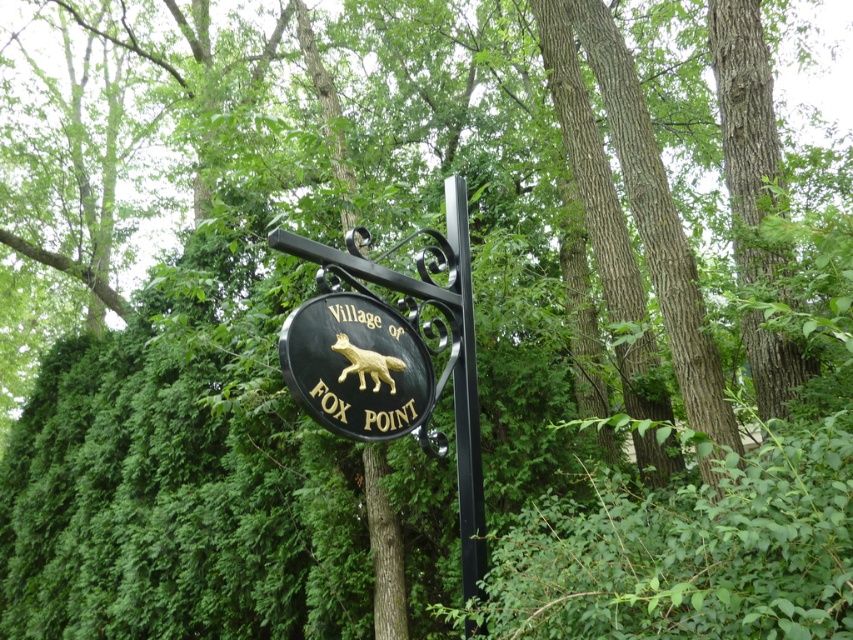
Question: Does gold metallic fox at center come in front of black polished wood sign at center?

Choices:
 (A) yes
 (B) no

Answer: (B)

Question: Can you confirm if black polished wood sign at center is positioned to the left of black metal pole at center?

Choices:
 (A) yes
 (B) no

Answer: (A)

Question: Which object is the closest to the gold metallic fox at center?

Choices:
 (A) black polished wood sign at center
 (B) black metal pole at center

Answer: (A)

Question: Which object is the farthest from the black metal pole at center?

Choices:
 (A) gold metallic fox at center
 (B) black polished wood sign at center

Answer: (B)

Question: Is black polished wood sign at center below black metal pole at center?

Choices:
 (A) no
 (B) yes

Answer: (A)

Question: Based on their relative distances, which object is nearer to the gold metallic fox at center?

Choices:
 (A) black polished wood sign at center
 (B) black metal pole at center

Answer: (A)